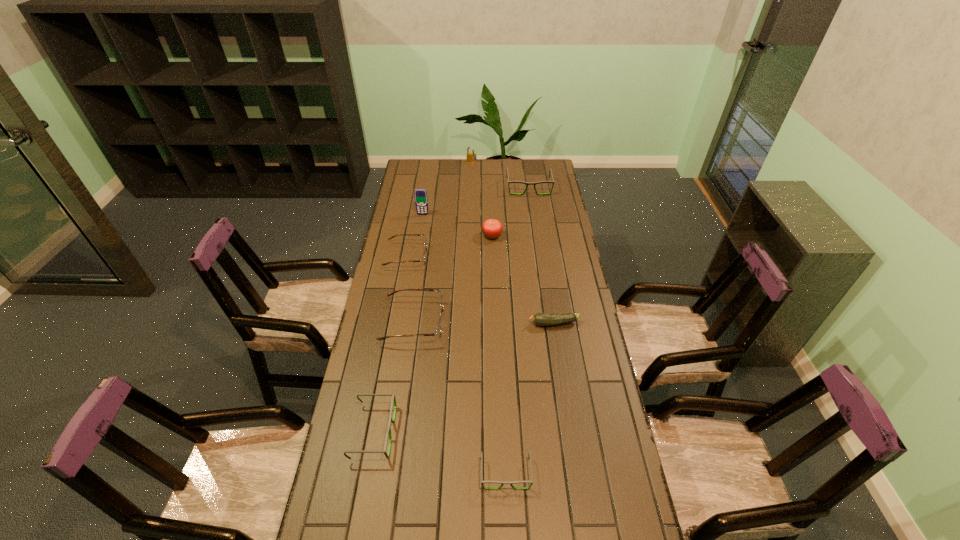
Image resolution: width=960 pixels, height=540 pixels. Identify the location of the tallest object. (421, 199).

This screenshot has width=960, height=540. I want to click on cellular telephone, so click(421, 199).

Where is `padlock`? The image size is (960, 540). padlock is located at coordinates (471, 157).

Identify the location of the farthest object. (471, 157).

You are a GUI agent. You are given a task and a screenshot of the screen. Output one action in this format:
    pyautogui.click(x=<x>, y=<y>)
    Task: Click on the apple
    
    Given the screenshot: What is the action you would take?
    [491, 228]

Locate an element on the screen. The width and height of the screenshot is (960, 540). red apple is located at coordinates (491, 228).

Identify the location of the biggest black spectacles. (527, 183).

In order to click on the farthest spectacles in this screenshot , I will do coord(527,183).

Find the location of `the nearer brown spectacles`. the nearer brown spectacles is located at coordinates (438, 333).

Locate an element on the screen. The width and height of the screenshot is (960, 540). the bigger brown spectacles is located at coordinates [x=438, y=333].